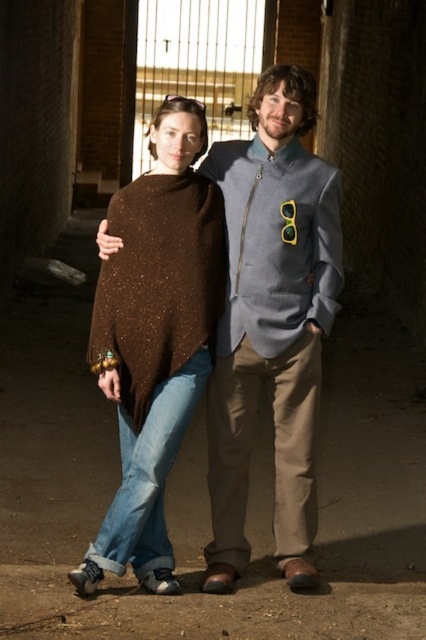
Question: Which point appears closest to the camera in this image?

Choices:
 (A) tap(192, 216)
 (B) tap(299, 106)

Answer: (A)

Question: Can you confirm if light blue textured jacket at center is bigger than brown speckled knit shawl at center?

Choices:
 (A) no
 (B) yes

Answer: (B)

Question: Which point appears closest to the camera in this image?

Choices:
 (A) (132, 285)
 (B) (146, 337)
 (C) (247, 195)

Answer: (B)

Question: Estimate the real-world distances between objects in this image. Which object is closer to the brown textured sweater at center?

Choices:
 (A) brown speckled knit shawl at center
 (B) light blue textured jacket at center

Answer: (A)

Question: In this image, where is brown textured sweater at center located relative to brown speckled knit shawl at center?

Choices:
 (A) above
 (B) below

Answer: (B)

Question: Does light blue textured jacket at center have a lesser width compared to brown textured sweater at center?

Choices:
 (A) yes
 (B) no

Answer: (A)